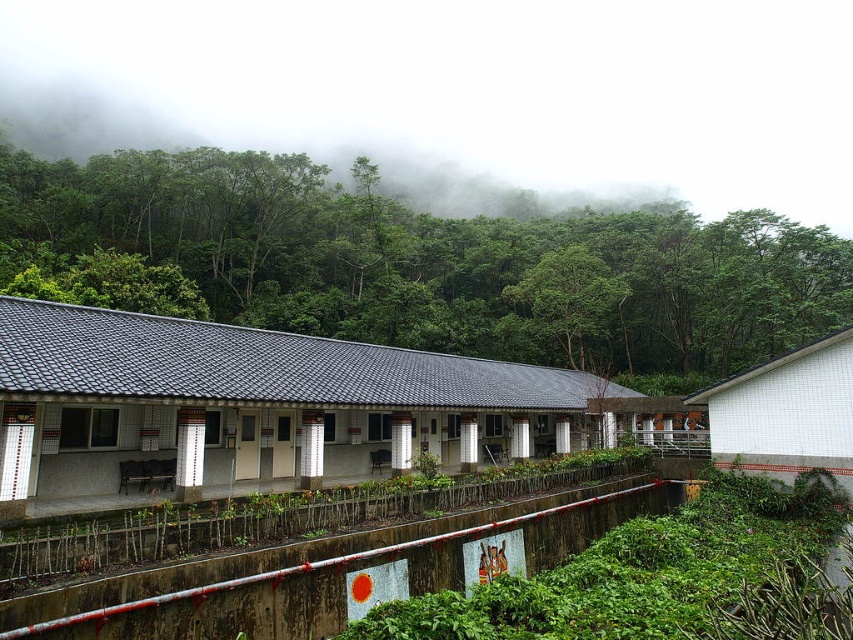
Question: Which object is closer to the camera taking this photo?

Choices:
 (A) green leafy trees at upper center
 (B) green leafy tree at center

Answer: (A)

Question: Is green leafy trees at upper center below green leafy tree at center?

Choices:
 (A) yes
 (B) no

Answer: (B)

Question: Does green leafy trees at upper center appear on the right side of green leafy tree at center?

Choices:
 (A) no
 (B) yes

Answer: (A)

Question: Can you confirm if green leafy trees at upper center is positioned above green leafy tree at center?

Choices:
 (A) yes
 (B) no

Answer: (A)